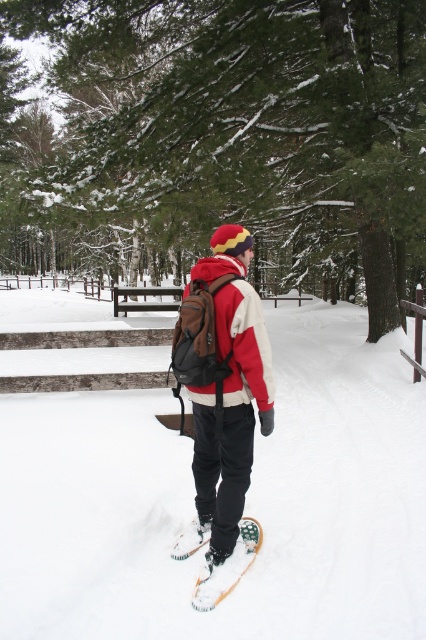
You are a snowboarder preparing to ride down a slope. You have a matte brown backpack at center and a green rubber snowboard at lower center. Can you safely place your snowboard next to your backpack without moving either item? Explain why or why not.

The distance between the matte brown backpack at center and the green rubber snowboard at lower center is 57.54 centimeters. Since the snowboard needs to be placed next to the backpack, this distance is sufficient as 57.54 cm provides enough space for placement without needing to move either item.

You are packing for a winter hike and have a matte brown backpack at center and a red fleece jacket at center. If you need to carry both items, which one should you choose to place first in the backpack to ensure both fit properly?

The matte brown backpack at center is larger in size than the red fleece jacket at center, so you should place the red fleece jacket at center first inside the backpack to make space for the larger matte brown backpack at center. However, since the backpack itself is the container, this might be a trick question. Please clarify if the backpack is the container or an item to be packed.

You are planning to pack your matte brown backpack at center and green rubber snowboard at lower center for a winter trip. Given their sizes, which item can you place first into a narrow storage compartment that can only fit one item at a time?

The green rubber snowboard at lower center can be placed first into the narrow storage compartment since its width is smaller than the matte brown backpack at center.